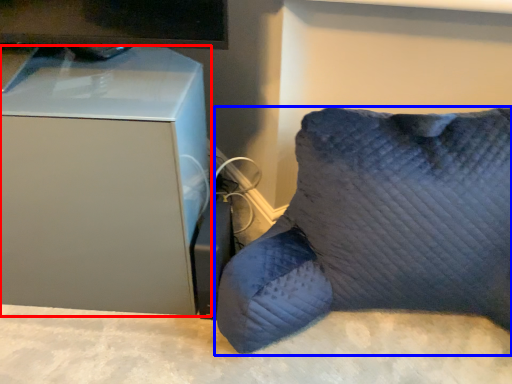
Question: Which object appears closest to the camera in this image, furniture (highlighted by a red box) or furniture (highlighted by a blue box)?

Choices:
 (A) furniture
 (B) furniture

Answer: (B)